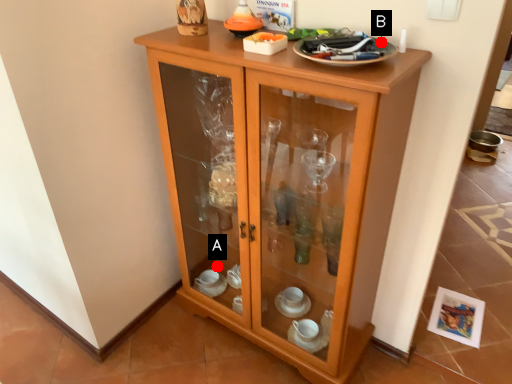
Question: Two points are circled on the image, labeled by A and B beside each circle. Which point is closer to the camera?

Choices:
 (A) A is closer
 (B) B is closer

Answer: (B)